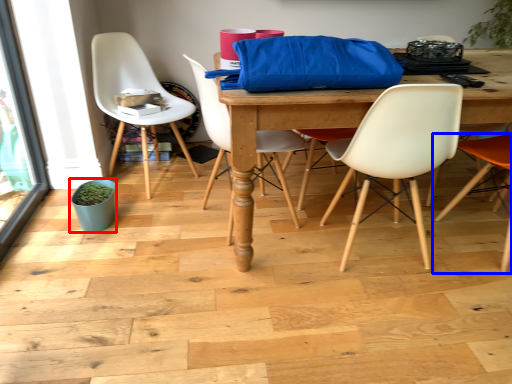
Question: Which point is further to the camera, flowerpot (highlighted by a red box) or chair (highlighted by a blue box)?

Choices:
 (A) flowerpot
 (B) chair

Answer: (A)